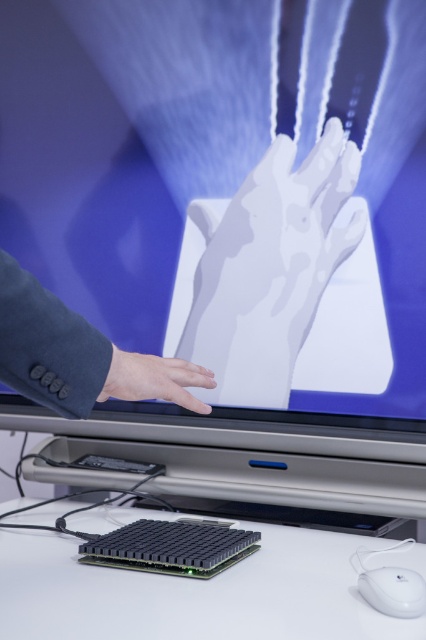
You are standing in front of the interactive screen system. There is a point at coordinates point (250, 291) that you need to reach with your hand. Considering your arm length is 0.7 meters, can you reach that point without moving closer to the screen?

The distance between you and point (250, 291) is 1.08 meters. Since your arm is only 0.7 meters long, you cannot reach the point without moving closer to the screen.

You are setting up a new interactive system and need to place a 10 cm tall sensor on the white plastic table at lower center. The white matte hand at center is part of the system. Considering their heights, will the sensor fit on the table without blocking the hand?

The white plastic table at lower center has a lesser height compared to the white matte hand at center. Since the sensor is only 10 cm tall, it should fit on the table without obstructing the hand as the table is shorter than the hand, allowing space for both.

You are designing a new interactive system and need to ensure that both the white matte hand at center and the white plastic mouse at lower right are visible to users. Based on their sizes, which object might require more space in the design?

The white matte hand at center might require more space in the design since it is wider than the white plastic mouse at lower right according to the description.